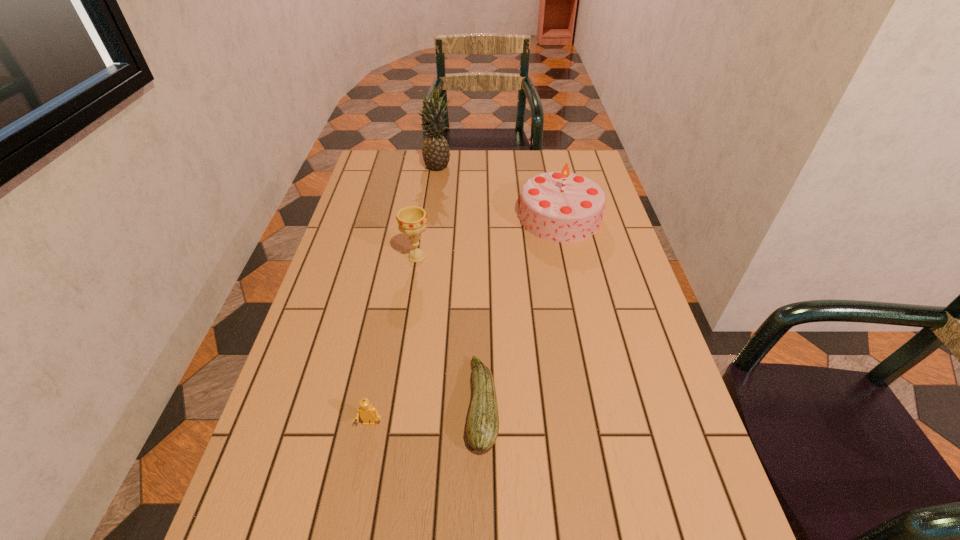
Identify the location of empty space that is in between the zucchini and the third farthest object. The image size is (960, 540). (449, 331).

Find the location of a particular element. This screenshot has height=540, width=960. free spot between the Lego and the birthday cake is located at coordinates (465, 320).

Where is `the third closest object to the chalice`? the third closest object to the chalice is located at coordinates (435, 151).

I want to click on object that is the fourth closest one to the farthest object, so click(x=369, y=414).

Where is `vacant space that satisfies the following two spatial constraints: 1. at the stem end of the zucchini; 2. on the face of the Lego`? This screenshot has height=540, width=960. vacant space that satisfies the following two spatial constraints: 1. at the stem end of the zucchini; 2. on the face of the Lego is located at coordinates (483, 423).

Identify the location of blank area in the image that satisfies the following two spatial constraints: 1. on the front side of the pineapple; 2. on the right side of the rightmost object. (432, 217).

Identify the location of vacant point that satisfies the following two spatial constraints: 1. on the back side of the third nearest object; 2. on the right side of the rightmost object. (x=423, y=217).

Where is `free space that satisfies the following two spatial constraints: 1. on the front side of the rightmost object; 2. at the stem end of the zucchini`? This screenshot has height=540, width=960. free space that satisfies the following two spatial constraints: 1. on the front side of the rightmost object; 2. at the stem end of the zucchini is located at coordinates (601, 405).